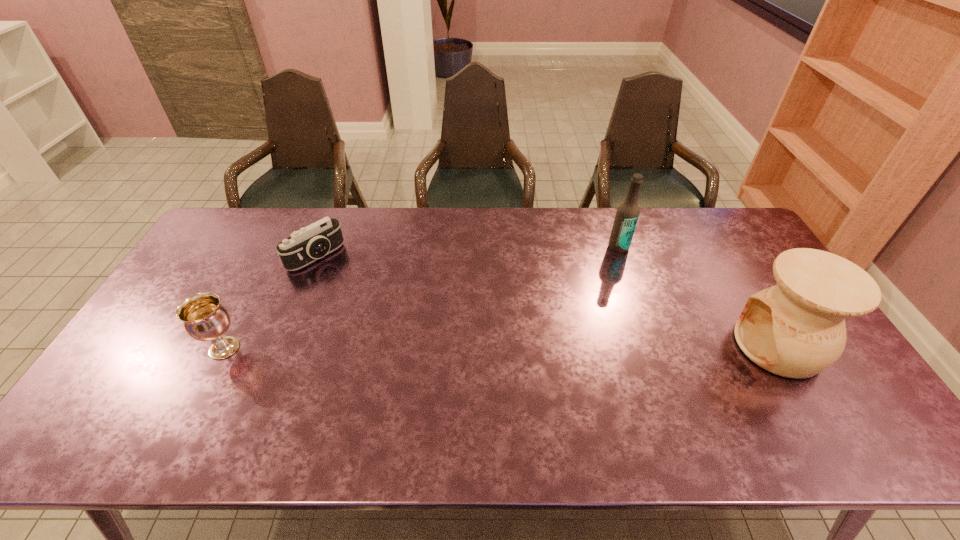
Identify the location of free space located 0.090m on the front lens of the camera. (346, 282).

Locate an element on the screen. This screenshot has width=960, height=540. vacant space located on the front lens of the camera is located at coordinates (389, 319).

At what (x,y) coordinates should I click in order to perform the action: click on free location located 0.190m on the front lens of the camera. Please return your answer as a coordinate pair (x, y). Looking at the image, I should click on (364, 298).

This screenshot has width=960, height=540. Find the location of `free space located on the label of the second object from right to left`. free space located on the label of the second object from right to left is located at coordinates (611, 268).

The height and width of the screenshot is (540, 960). I want to click on free space located on the label of the second object from right to left, so click(602, 291).

Find the location of a particular element. Image resolution: width=960 pixels, height=540 pixels. vacant space located on the label of the second object from right to left is located at coordinates (603, 288).

The height and width of the screenshot is (540, 960). In order to click on camera at the far edge in this screenshot , I will do `click(303, 247)`.

Locate an element on the screen. beer bottle that is at the far edge is located at coordinates (627, 214).

At what (x,y) coordinates should I click in order to perform the action: click on object present at the near edge. Please return your answer as a coordinate pair (x, y). Looking at the image, I should click on (796, 329).

Where is `object present at the right edge`? object present at the right edge is located at coordinates (796, 329).